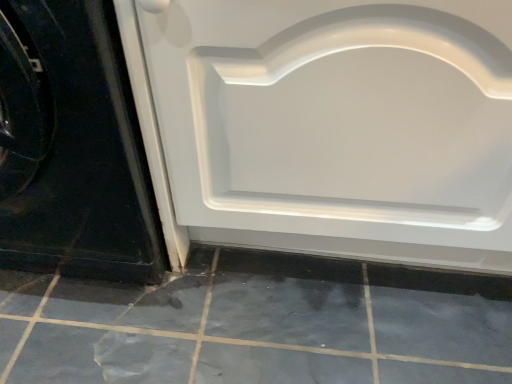
Measure the distance between white glossy door at center, which appears as the 2th door when viewed from the left, and camera.

white glossy door at center, which appears as the 2th door when viewed from the left, and camera are 17.83 inches apart from each other.

From the picture: What is the approximate width of gray matte tile at lower center?

gray matte tile at lower center is 3.56 feet in width.

Identify the location of white glossy door at center, marked as the first door in a right-to-left arrangement. (330, 126).

Is white glossy door at lower left, which appears as the second door when viewed from the right, at the back of gray matte tile at lower center?

No, white glossy door at lower left, which appears as the second door when viewed from the right, is not at the back of gray matte tile at lower center.

Is gray matte tile at lower center situated inside white glossy door at lower left, which appears as the second door when viewed from the right, or outside?

gray matte tile at lower center cannot be found inside white glossy door at lower left, which appears as the second door when viewed from the right.

Is point (66, 312) closer to viewer compared to point (81, 238)?

That is True.

Is gray matte tile at lower center wider than white glossy door at lower left, which is the first door from left to right?

Yes.

Which object is thinner, gray matte tile at lower center or white glossy door at center, which appears as the 2th door when viewed from the left?

white glossy door at center, which appears as the 2th door when viewed from the left, is thinner.

From the gray matte tile at lower center, count 2nd doors forward and point to it. Please provide its 2D coordinates.

[(330, 126)]

Is gray matte tile at lower center shorter than white glossy door at center, marked as the first door in a right-to-left arrangement?

Indeed, gray matte tile at lower center has a lesser height compared to white glossy door at center, marked as the first door in a right-to-left arrangement.

Are gray matte tile at lower center and white glossy door at center, which appears as the 2th door when viewed from the left, beside each other?

No, gray matte tile at lower center is not making contact with white glossy door at center, which appears as the 2th door when viewed from the left.

Can white glossy door at center, which appears as the 2th door when viewed from the left, be found inside white glossy door at lower left, which is the first door from left to right?

No, white glossy door at center, which appears as the 2th door when viewed from the left, is not a part of white glossy door at lower left, which is the first door from left to right.

Can you see white glossy door at lower left, which appears as the second door when viewed from the right, touching white glossy door at center, which appears as the 2th door when viewed from the left?

No, white glossy door at lower left, which appears as the second door when viewed from the right, is not in contact with white glossy door at center, which appears as the 2th door when viewed from the left.

Is white glossy door at lower left, which appears as the second door when viewed from the right, turned away from white glossy door at center, marked as the first door in a right-to-left arrangement?

No, white glossy door at lower left, which appears as the second door when viewed from the right, is not facing away from white glossy door at center, marked as the first door in a right-to-left arrangement.

From the picture: From the image's perspective, is white glossy door at lower left, which is the first door from left to right, beneath white glossy door at center, which appears as the 2th door when viewed from the left?

Actually, white glossy door at lower left, which is the first door from left to right, appears above white glossy door at center, which appears as the 2th door when viewed from the left, in the image.

Which object is wider, white glossy door at center, marked as the first door in a right-to-left arrangement, or white glossy door at lower left, which is the first door from left to right?

With larger width is white glossy door at lower left, which is the first door from left to right.

Considering the points (499, 181) and (28, 91), which point is in front, point (499, 181) or point (28, 91)?

The point (28, 91) is closer to the camera.

In terms of size, does white glossy door at center, marked as the first door in a right-to-left arrangement, appear bigger or smaller than white glossy door at lower left, which is the first door from left to right?

In the image, white glossy door at center, marked as the first door in a right-to-left arrangement, appears to be larger than white glossy door at lower left, which is the first door from left to right.

Is white glossy door at center, marked as the first door in a right-to-left arrangement, spatially inside white glossy door at lower left, which is the first door from left to right, or outside of it?

The correct answer is: outside.

Are white glossy door at center, which appears as the 2th door when viewed from the left, and gray matte tile at lower center located far from each other?

No, white glossy door at center, which appears as the 2th door when viewed from the left, is in close proximity to gray matte tile at lower center.

Is point (482, 266) positioned behind point (241, 262)?

That is False.

In the image, is white glossy door at center, marked as the first door in a right-to-left arrangement, positioned in front of or behind gray matte tile at lower center?

white glossy door at center, marked as the first door in a right-to-left arrangement, is in front of gray matte tile at lower center.

Could you tell me if white glossy door at lower left, which is the first door from left to right, is facing gray matte tile at lower center?

No, white glossy door at lower left, which is the first door from left to right, does not turn towards gray matte tile at lower center.

From a real-world perspective, is white glossy door at lower left, which appears as the second door when viewed from the right, over gray matte tile at lower center?

Correct, in the physical world, white glossy door at lower left, which appears as the second door when viewed from the right, is higher than gray matte tile at lower center.

I want to click on door to the left of gray matte tile at lower center, so click(x=72, y=147).

Identify the location of ceramic tile below the white glossy door at center, marked as the first door in a right-to-left arrangement (from the image's perspective). The width and height of the screenshot is (512, 384). (259, 324).

Based on their spatial positions, is white glossy door at lower left, which is the first door from left to right, or gray matte tile at lower center closer to white glossy door at center, which appears as the 2th door when viewed from the left?

white glossy door at lower left, which is the first door from left to right, is positioned closer to the anchor white glossy door at center, which appears as the 2th door when viewed from the left.

Looking at the image, which one is located further to white glossy door at center, marked as the first door in a right-to-left arrangement, gray matte tile at lower center or white glossy door at lower left, which appears as the second door when viewed from the right?

gray matte tile at lower center is positioned further to the anchor white glossy door at center, marked as the first door in a right-to-left arrangement.

Considering their positions, is gray matte tile at lower center positioned further to white glossy door at lower left, which appears as the second door when viewed from the right, than white glossy door at center, which appears as the 2th door when viewed from the left?

gray matte tile at lower center is positioned further to the anchor white glossy door at lower left, which appears as the second door when viewed from the right.

Considering their positions, is white glossy door at lower left, which is the first door from left to right, positioned closer to gray matte tile at lower center than white glossy door at center, which appears as the 2th door when viewed from the left?

white glossy door at center, which appears as the 2th door when viewed from the left, is positioned closer to the anchor gray matte tile at lower center.

When comparing their distances from white glossy door at lower left, which appears as the second door when viewed from the right, does white glossy door at center, marked as the first door in a right-to-left arrangement, or gray matte tile at lower center seem closer?

Based on the image, white glossy door at center, marked as the first door in a right-to-left arrangement, appears to be nearer to white glossy door at lower left, which appears as the second door when viewed from the right.

Consider the image. Looking at the image, which one is located further to gray matte tile at lower center, white glossy door at center, marked as the first door in a right-to-left arrangement, or white glossy door at lower left, which is the first door from left to right?

Among the two, white glossy door at lower left, which is the first door from left to right, is located further to gray matte tile at lower center.

In order to click on ceramic tile between white glossy door at lower left, which appears as the second door when viewed from the right, and white glossy door at center, which appears as the 2th door when viewed from the left in this screenshot , I will do `click(259, 324)`.